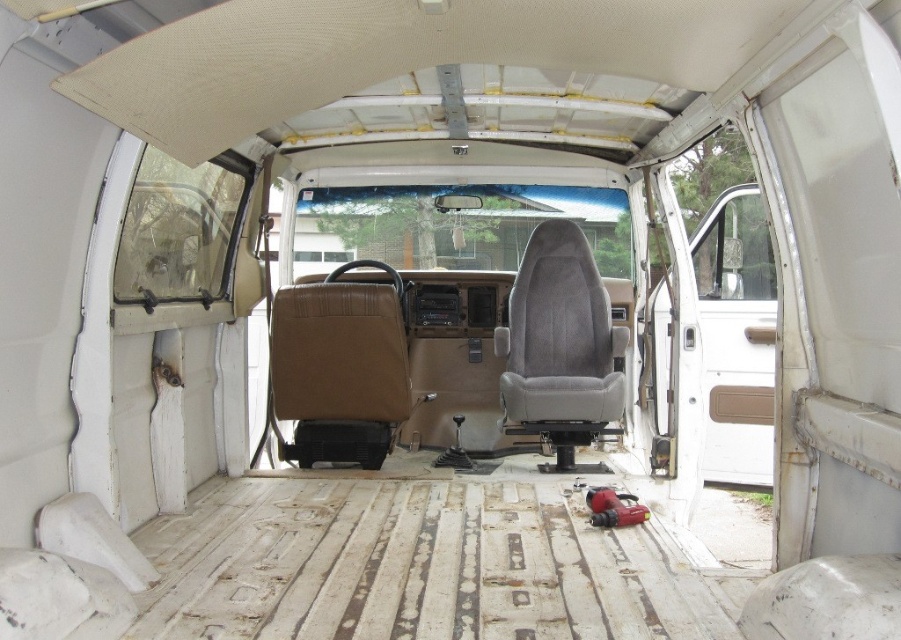
Question: Can you confirm if brown leather seat at center is positioned to the left of gray fabric seat at center?

Choices:
 (A) no
 (B) yes

Answer: (B)

Question: Considering the relative positions of brown leather seat at center and gray fabric seat at center in the image provided, where is brown leather seat at center located with respect to gray fabric seat at center?

Choices:
 (A) below
 (B) above

Answer: (A)

Question: Does brown leather seat at center come in front of gray fabric seat at center?

Choices:
 (A) yes
 (B) no

Answer: (A)

Question: Which of the following is the farthest from the observer?

Choices:
 (A) (370, 368)
 (B) (580, 317)

Answer: (B)

Question: Among these objects, which one is farthest from the camera?

Choices:
 (A) gray fabric seat at center
 (B) brown leather seat at center

Answer: (A)